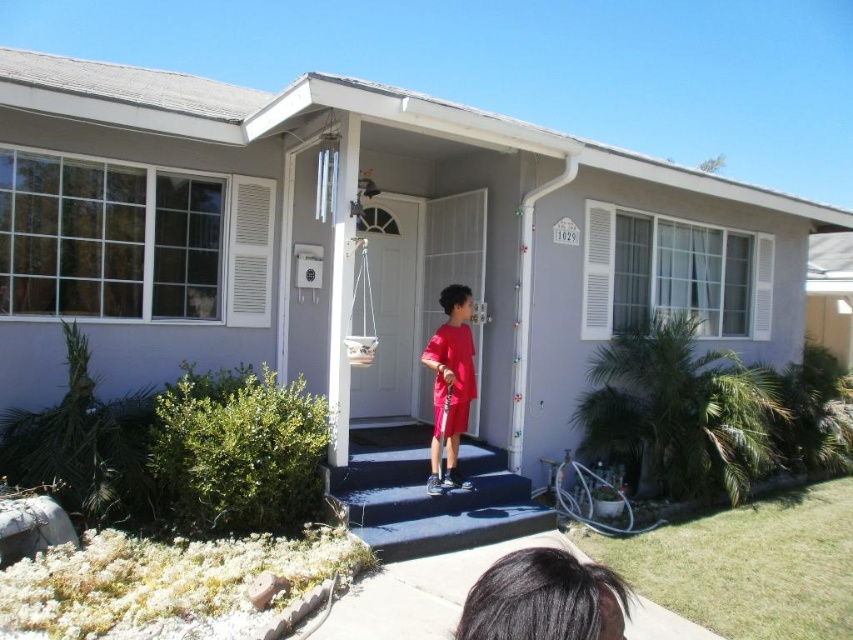
Who is positioned more to the right, smooth concrete steps at center or matte red shorts at center?

matte red shorts at center

Which is behind, point (486, 522) or point (456, 483)?

The point (456, 483) is behind.

At what (x,y) coordinates should I click in order to perform the action: click on smooth concrete steps at center. Please return your answer as a coordinate pair (x, y). The height and width of the screenshot is (640, 853). Looking at the image, I should click on (428, 496).